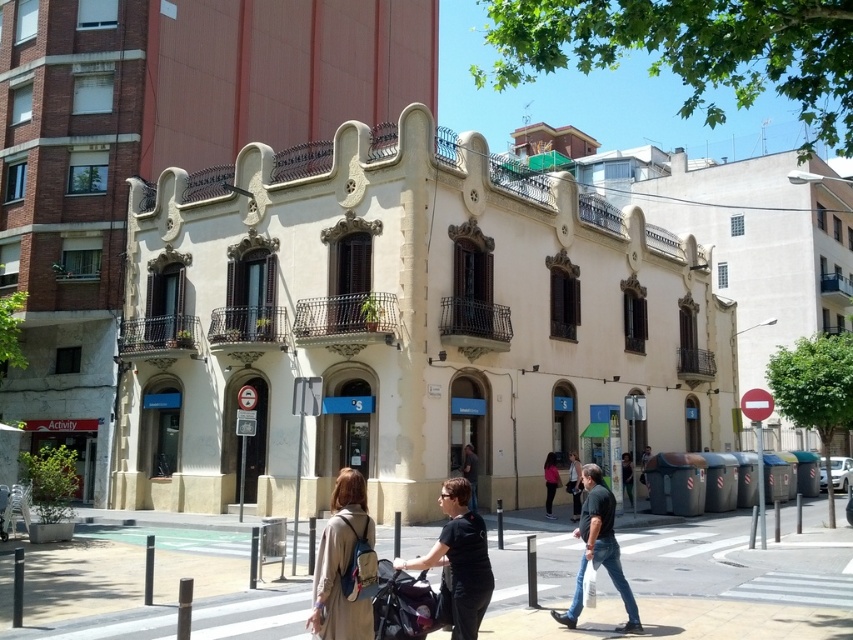
Who is taller, matte black jacket at center or dark brown leather jacket at center?

With more height is dark brown leather jacket at center.

Which is above, matte black jacket at center or dark brown leather jacket at center?

dark brown leather jacket at center is above.

Is point (566, 481) positioned after point (474, 464)?

Yes, point (566, 481) is behind point (474, 464).

Find the location of a particular element. matte black jacket at center is located at coordinates (573, 484).

Does dark gray fabric baby carriage at center have a lesser height compared to dark brown leather jacket at center?

Indeed, dark gray fabric baby carriage at center has a lesser height compared to dark brown leather jacket at center.

Looking at this image, is dark gray fabric baby carriage at center to the right of dark brown leather jacket at center from the viewer's perspective?

No, dark gray fabric baby carriage at center is not to the right of dark brown leather jacket at center.

This screenshot has height=640, width=853. Find the location of `dark gray fabric baby carriage at center`. dark gray fabric baby carriage at center is located at coordinates (407, 604).

Who is higher up, black matte stroller at lower center or dark green t-shirt at center?

black matte stroller at lower center is higher up.

Between point (480, 589) and point (608, 557), which one is positioned in front?

Positioned in front is point (480, 589).

Image resolution: width=853 pixels, height=640 pixels. I want to click on black matte stroller at lower center, so click(459, 560).